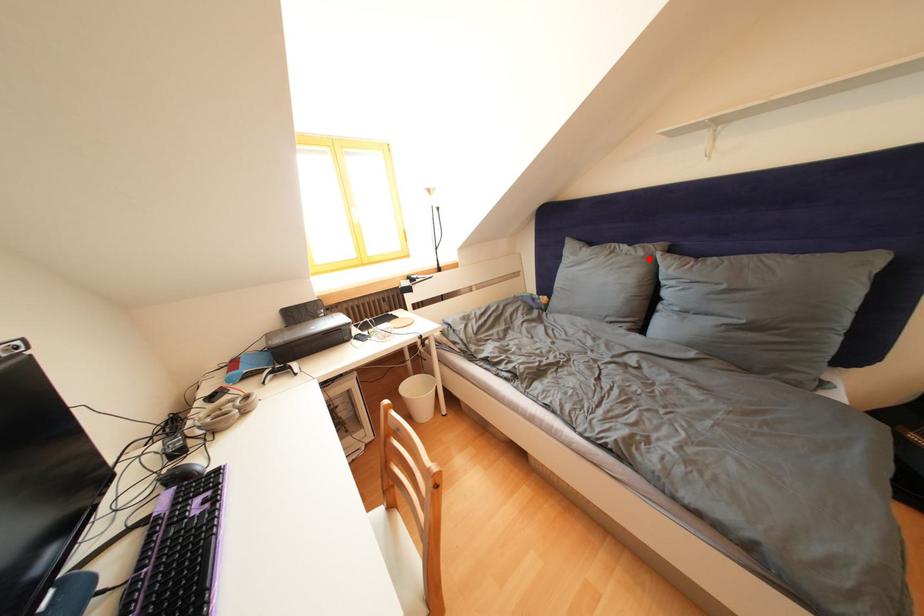
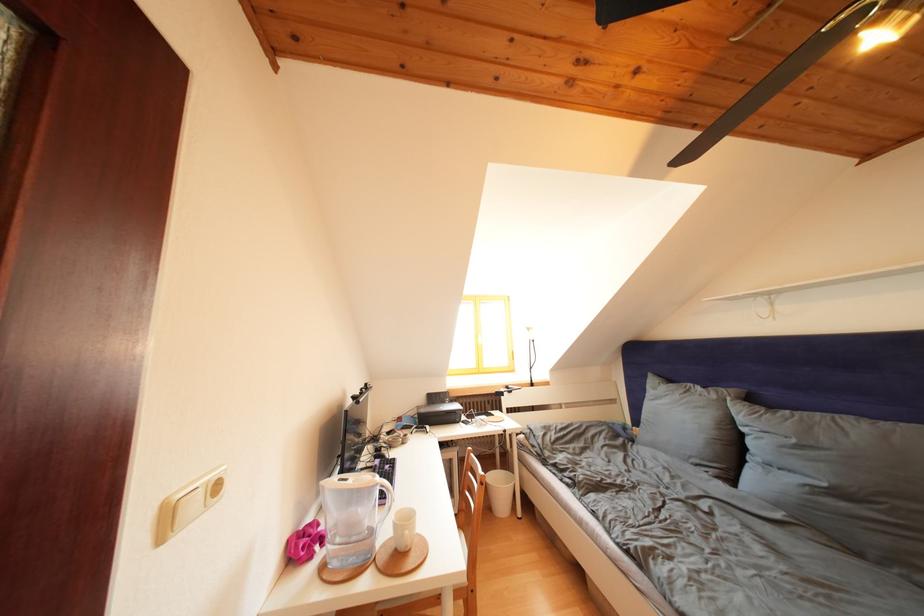
Find the pixel in the second image that matches the highlighted location in the first image.

(722, 402)